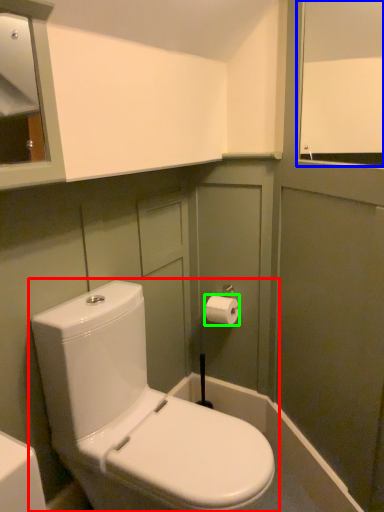
Question: Estimate the real-world distances between objects in this image. Which object is farther from toilet (highlighted by a red box), window screen (highlighted by a blue box) or toiletry (highlighted by a green box)?

Choices:
 (A) window screen
 (B) toiletry

Answer: (A)